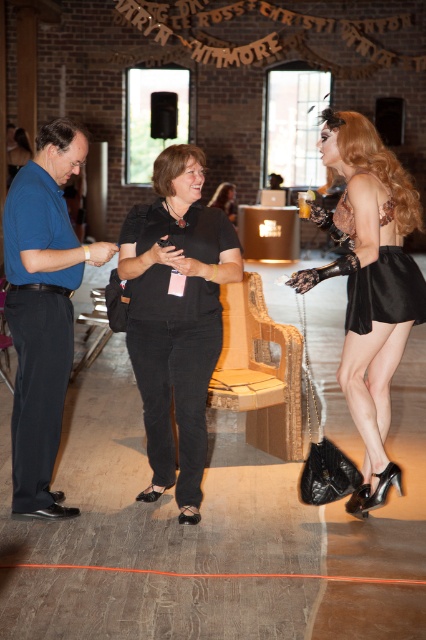
You are at a party and see two people wearing the blue smooth shirt at center and the black matte dress at center. Which clothing item is positioned lower on their bodies?

The blue smooth shirt at center is positioned lower on their bodies than the black matte dress at center.

You are at the coordinates of the velvet black dress at right. What is the nearest object to you?

The nearest object to the velvet black dress at right is the woman wearing a black short sleeved top, black pants, and black shoes with a lanyard around her neck.

You are at a party and want to find the velvet black dress at right and the black matte dress at center. Which one is positioned more to the right side of the room?

The velvet black dress at right is positioned more to the right side of the room compared to the black matte dress at center.